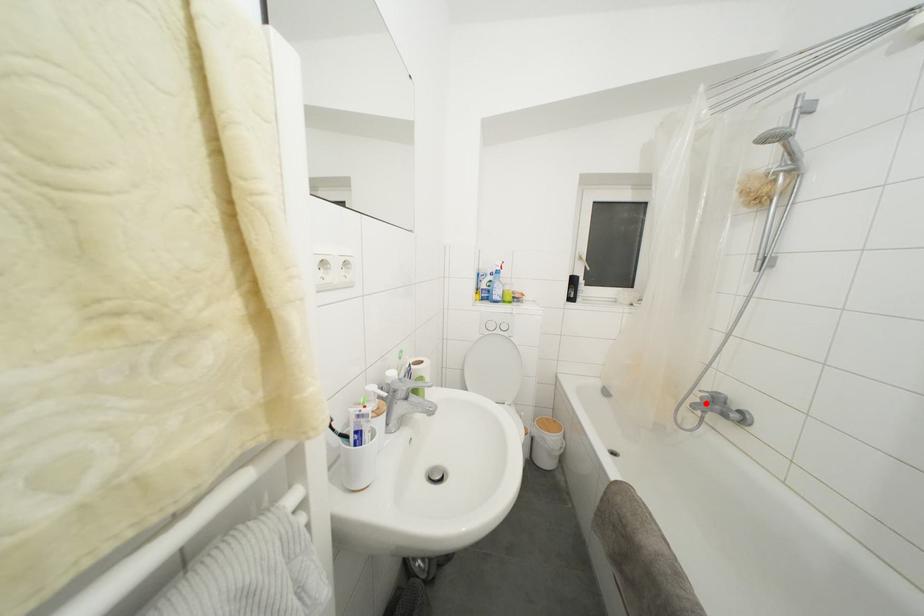
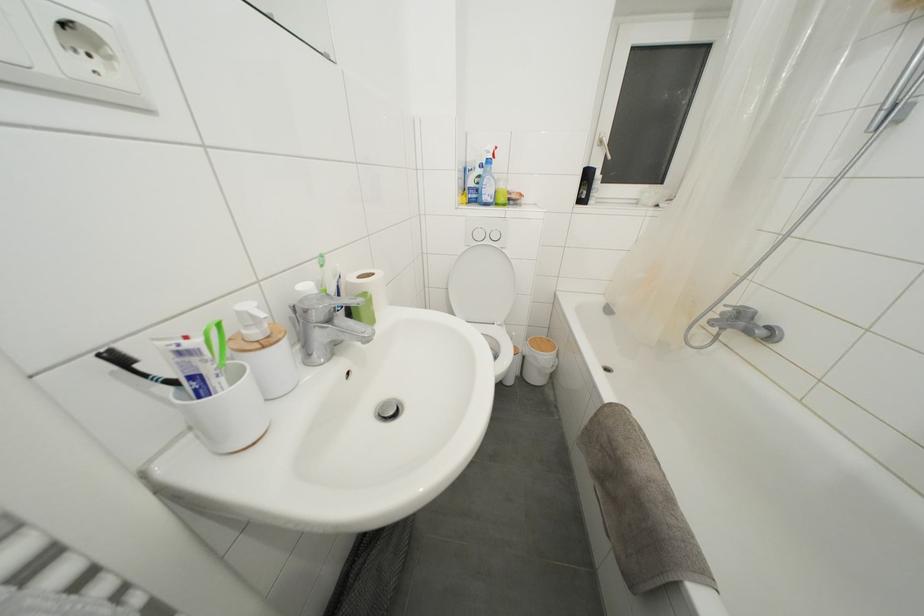
The point at the highlighted location is marked in the first image. Where is the corresponding point in the second image?

(726, 318)